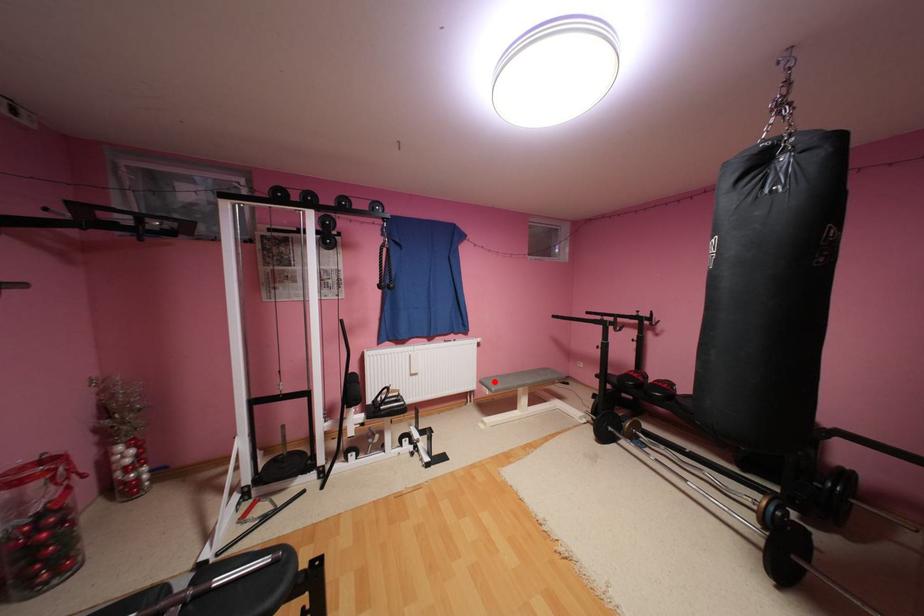
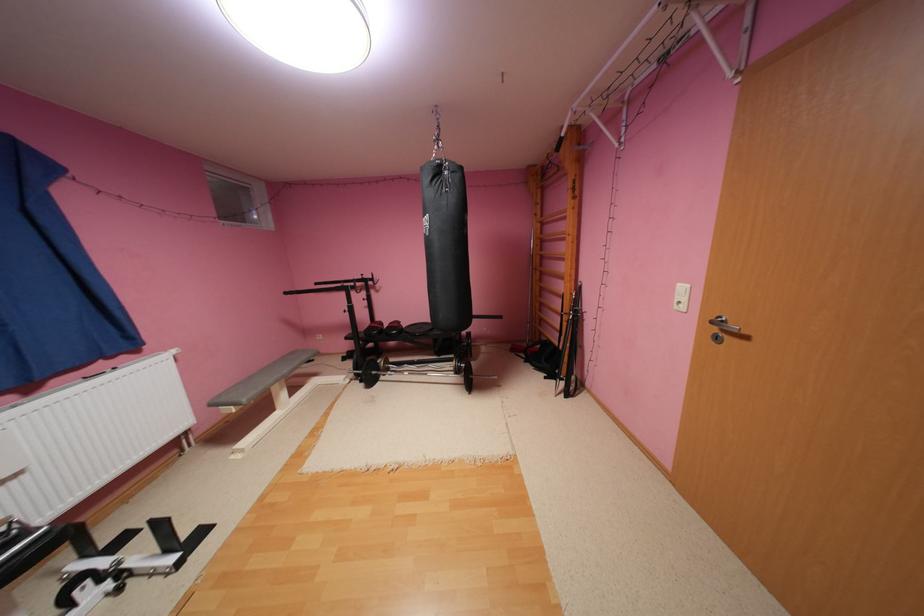
Locate, in the second image, the point that corresponds to the highlighted location in the first image.

(233, 399)